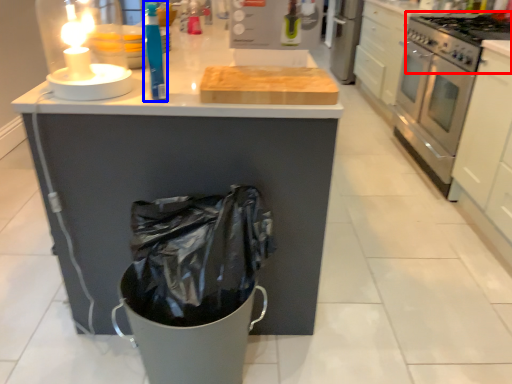
Question: Which object appears closest to the camera in this image, gas stove (highlighted by a red box) or cleaning product (highlighted by a blue box)?

Choices:
 (A) gas stove
 (B) cleaning product

Answer: (B)